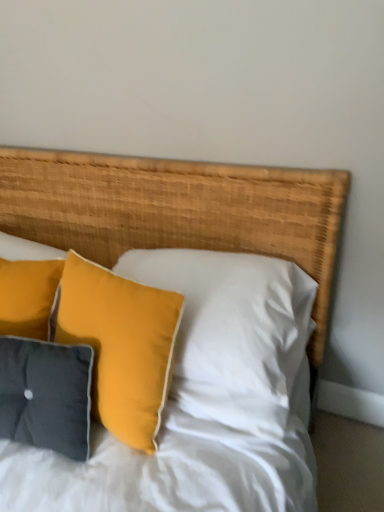
Describe the element at coordinates (176, 210) in the screenshot. I see `woven wood headboard at center` at that location.

Identify the location of woven wood headboard at center. (176, 210).

Locate an element on the screen. The width and height of the screenshot is (384, 512). woven wood headboard at center is located at coordinates (176, 210).